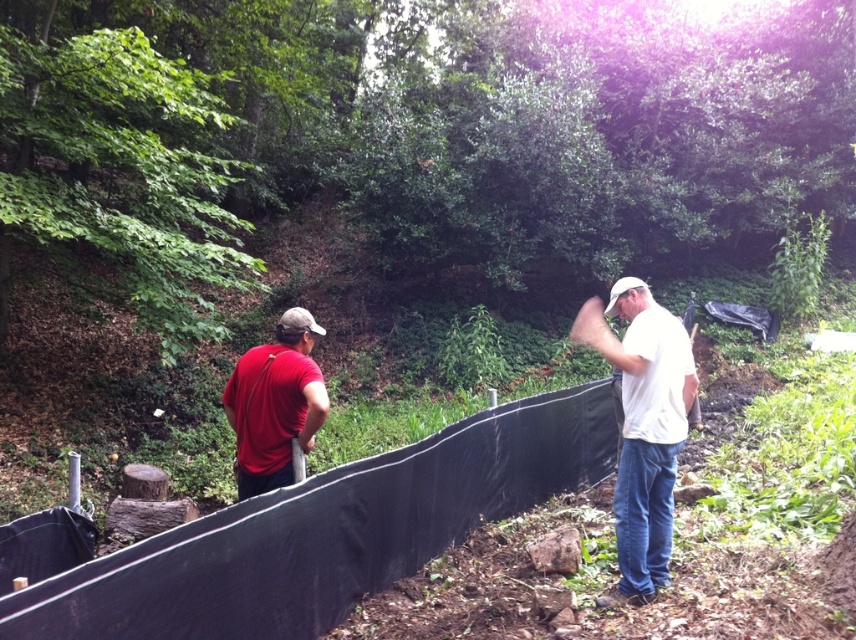
You are a worker in the forested area and need to place a tool exactly at the center of the black plastic fence at center. According to the coordinates provided, where should you place it?

The black plastic fence at center is located at point (325, 532), so you should place the tool exactly at those coordinates.

Consider the image. You are a construction worker who needs to determine if you can easily step over the black plastic fence at center while avoiding the white matte shirt at right. Can you do this?

The black plastic fence at center is shorter than the white matte shirt at right, so yes, you can easily step over the black plastic fence at center since it is not as tall as the white matte shirt at right.

You are a hiker who just arrived at this forested area. You see the white matte shirt at right and the matte red shirt at left. Which person is standing higher in elevation?

The white matte shirt at right is above the matte red shirt at left, indicating that the person in the white matte shirt at right is standing higher in elevation.